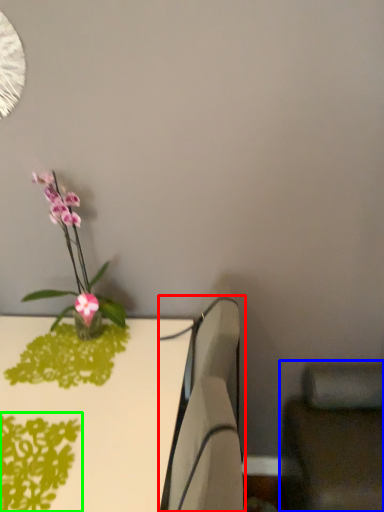
Question: Which object is the closest to the swivel chair (highlighted by a red box)? Choose among these: swivel chair (highlighted by a blue box) or plant (highlighted by a green box).

Choices:
 (A) swivel chair
 (B) plant

Answer: (B)